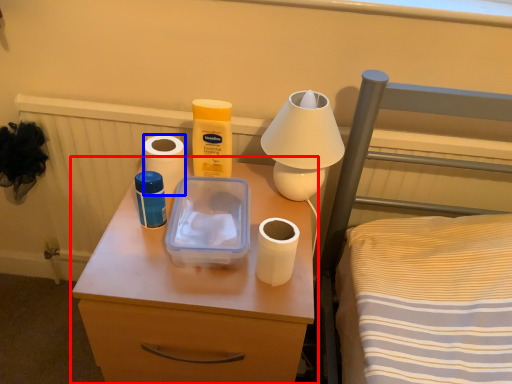
Question: Which object is closer to the camera taking this photo, nightstand (highlighted by a red box) or toilet paper (highlighted by a blue box)?

Choices:
 (A) nightstand
 (B) toilet paper

Answer: (A)